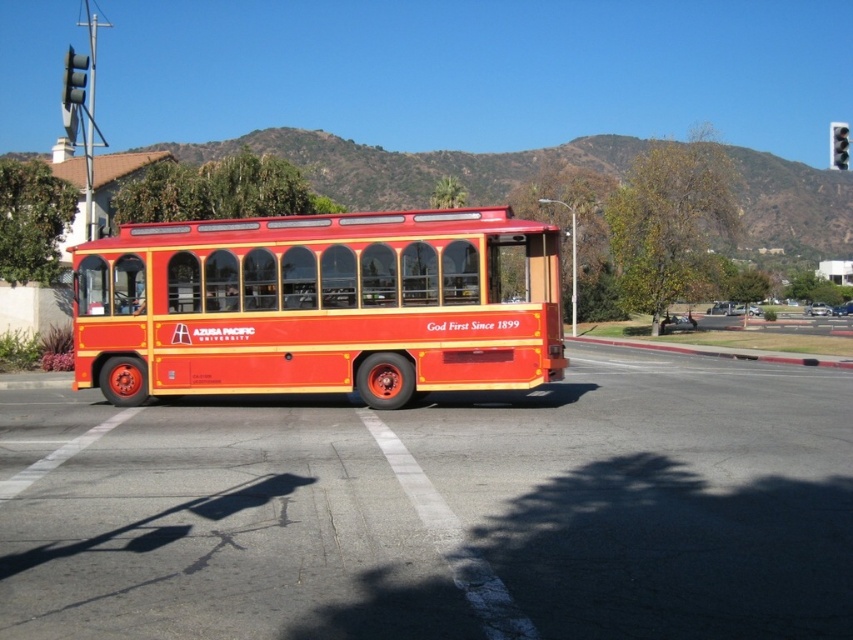
You are a photographer standing in front of the shiny red bus at center and the black plastic traffic light at upper right. You want to capture a photo where both objects are visible in the frame. Based on their heights, which object will appear taller in the photo?

The black plastic traffic light at upper right will appear taller in the photo since the shiny red bus at center has a lesser height compared to it.

You are a driver approaching the intersection where the black glass traffic light at upper left and the black plastic traffic light at upper right are present. Which traffic light is positioned higher relative to the other?

The black glass traffic light at upper left is located above the black plastic traffic light at upper right.

You are standing at the point with coordinates 0.5, 0.5 in the image. You want to locate the shiny red bus at center. In which direction should you move relative to your current position?

The shiny red bus at center is located at point (x=317, y=307). Since your current position is at (x=426, y=320), you should move down and to the left to reach it.